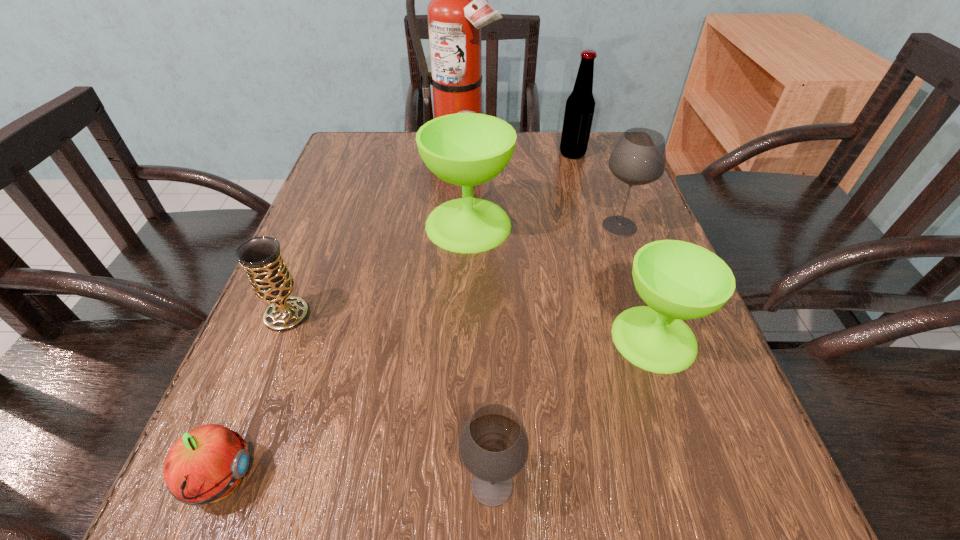
Identify the location of fire extinguisher. The width and height of the screenshot is (960, 540). [x=458, y=9].

I want to click on red fire extinguisher, so click(458, 9).

Locate an element on the screen. The image size is (960, 540). beer bottle is located at coordinates (579, 110).

Where is `the left green wineglass`? the left green wineglass is located at coordinates (466, 149).

At what (x,y) coordinates should I click in order to perform the action: click on the bigger green wineglass. Please return your answer as a coordinate pair (x, y). The width and height of the screenshot is (960, 540). Looking at the image, I should click on tap(466, 149).

Identify the location of the farther gray wineglass. click(639, 157).

Locate an element on the screen. This screenshot has height=540, width=960. the right gray wineglass is located at coordinates click(x=639, y=157).

Find the location of a particular element. This screenshot has width=960, height=540. the right green wineglass is located at coordinates (678, 280).

At what (x,y) coordinates should I click in order to perform the action: click on the smaller green wineglass. Please return your answer as a coordinate pair (x, y). The height and width of the screenshot is (540, 960). Looking at the image, I should click on (678, 280).

Locate an element on the screen. The image size is (960, 540). the smaller gray wineglass is located at coordinates (494, 446).